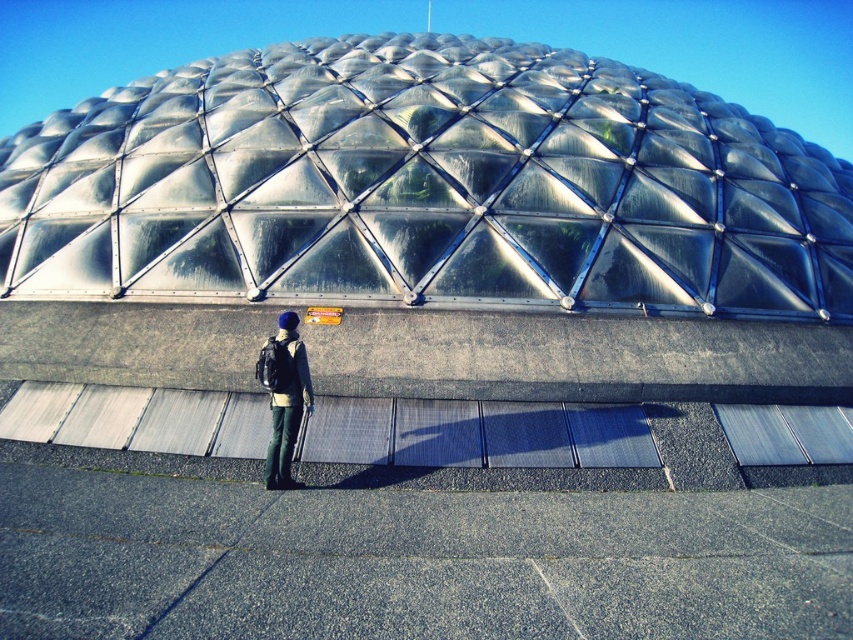
The width and height of the screenshot is (853, 640). What do you see at coordinates (425, 186) in the screenshot?
I see `metallic silver dome at upper center` at bounding box center [425, 186].

Who is shorter, metallic silver dome at upper center or dark blue fabric backpack at center?

dark blue fabric backpack at center is shorter.

Is point (831, 300) positioned before point (271, 392)?

No, it is not.

The width and height of the screenshot is (853, 640). In order to click on metallic silver dome at upper center in this screenshot , I will do `click(425, 186)`.